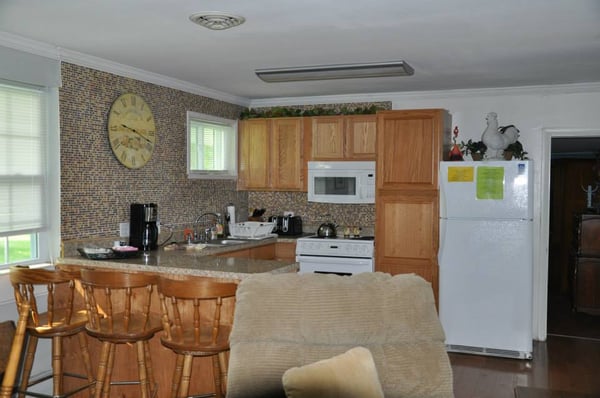
Locate an element on the screen. The image size is (600, 398). chairs is located at coordinates (111, 310), (36, 294), (178, 318).